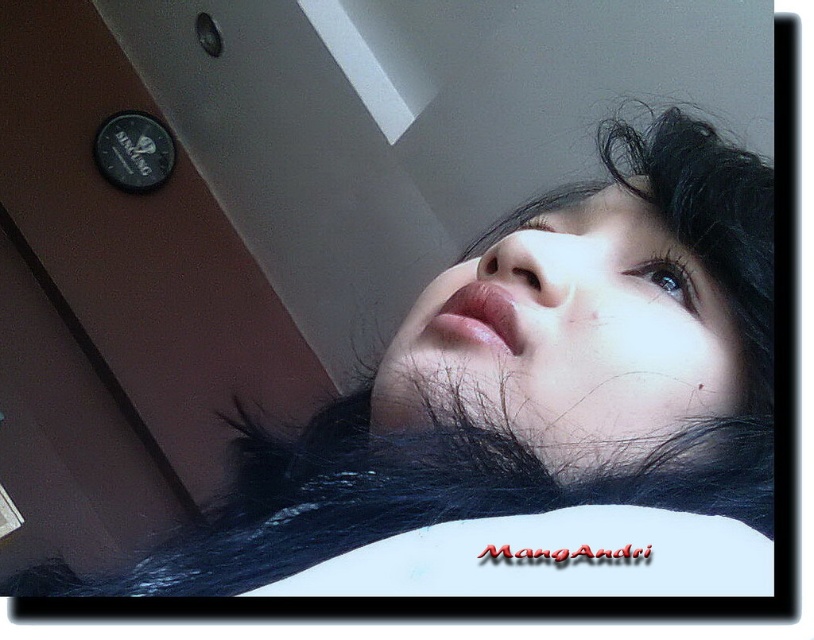
You are a photographer adjusting your camera settings. You notice a point at coordinates point (681, 282) in the frame that needs to be in focus. If your camera has a depth of field that can sharply focus objects within 20 inches from the current focus point, should you adjust the focus to ensure this point is sharp?

The point (681, 282) is 21.33 inches away from the camera, which is beyond the 20 inches depth of field range. Therefore, you should adjust the focus to ensure this point is sharp.

You are a photographer adjusting your camera settings. You notice a point at coordinates (532, 412) in the image. Based on the scene description, what part of the person is most likely located at that coordinate?

The point at coordinates (532, 412) corresponds to the smooth skin face at upper center.

Looking at this image, you are a photographer adjusting lighting for a portrait. You notice the smooth skin face at upper center and the black glossy eye at upper center. Which object is located lower in the image?

The smooth skin face at upper center is positioned under the black glossy eye at upper center, meaning the smooth skin face at upper center is lower in the image.